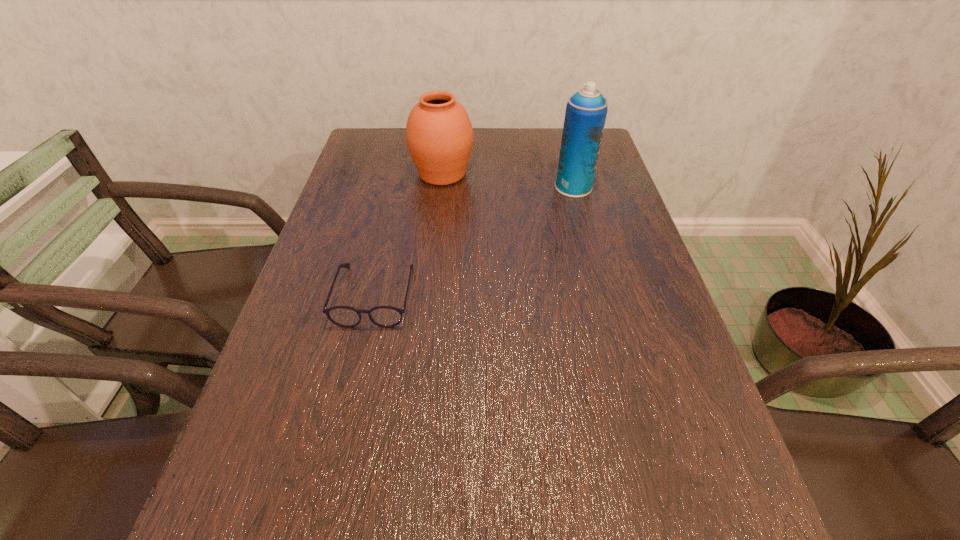
Identify the location of aerosol can. (586, 110).

Find the location of a particular element. The width and height of the screenshot is (960, 540). the rightmost object is located at coordinates (586, 110).

At what (x,y) coordinates should I click in order to perform the action: click on urn. Please return your answer as a coordinate pair (x, y). The height and width of the screenshot is (540, 960). Looking at the image, I should click on (439, 135).

Locate an element on the screen. spectacles is located at coordinates (343, 316).

In order to click on the nearest object in this screenshot , I will do `click(343, 316)`.

Locate an element on the screen. Image resolution: width=960 pixels, height=540 pixels. free region located on the back of the aerosol can is located at coordinates (562, 144).

Find the location of a particular element. This screenshot has height=540, width=960. vacant space situated on the front of the second tallest object is located at coordinates (439, 202).

Locate an element on the screen. This screenshot has width=960, height=540. free space located on the front-facing side of the spectacles is located at coordinates (324, 516).

This screenshot has width=960, height=540. What are the coordinates of `object that is at the far edge` in the screenshot? It's located at (439, 135).

This screenshot has height=540, width=960. I want to click on object present at the left edge, so click(x=343, y=316).